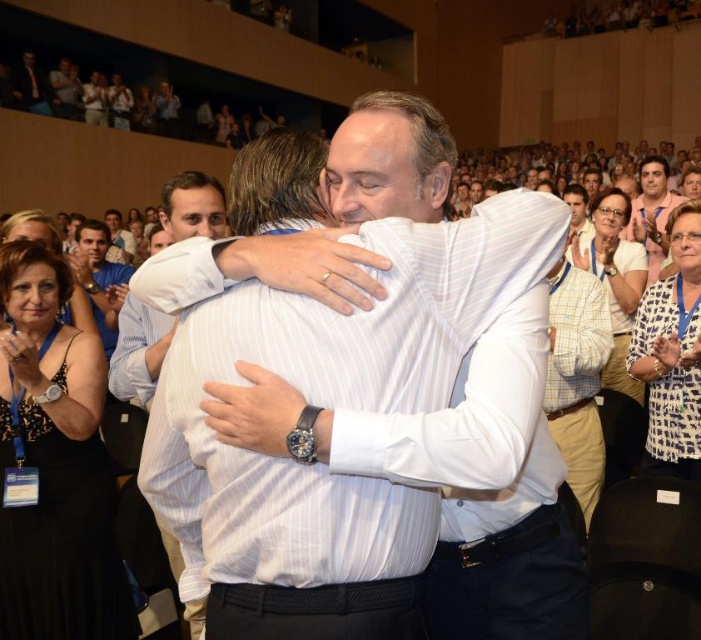
Consider the image. Who is lower down, white striped shirt at center or white dotted blouse at upper right?

white striped shirt at center

Does point (336, 378) lie behind point (697, 394)?

No, it is in front of (697, 394).

Is point (348, 528) farther from viewer compared to point (629, 346)?

No, (348, 528) is closer to viewer.

You are a GUI agent. You are given a task and a screenshot of the screen. Output one action in this format:
    pyautogui.click(x=<x>, y=<y>)
    Task: Click on the white striped shirt at center
    This screenshot has height=640, width=701.
    Given the screenshot: What is the action you would take?
    pyautogui.click(x=332, y=408)

Does white dotted blouse at upper right have a lesser width compared to white striped shirt at upper center?

Yes.

Is white dotted blouse at upper right positioned before white striped shirt at upper center?

Yes, it is in front of white striped shirt at upper center.

This screenshot has height=640, width=701. What do you see at coordinates (672, 353) in the screenshot?
I see `white dotted blouse at upper right` at bounding box center [672, 353].

This screenshot has width=701, height=640. What are the coordinates of `white dotted blouse at upper right` in the screenshot? It's located at (672, 353).

Describe the element at coordinates (672, 353) in the screenshot. I see `white dotted blouse at upper right` at that location.

Is white dotted blouse at upper right to the left of dark blue shirt at upper left from the viewer's perspective?

In fact, white dotted blouse at upper right is to the right of dark blue shirt at upper left.

In order to click on white dotted blouse at upper right in this screenshot , I will do tap(672, 353).